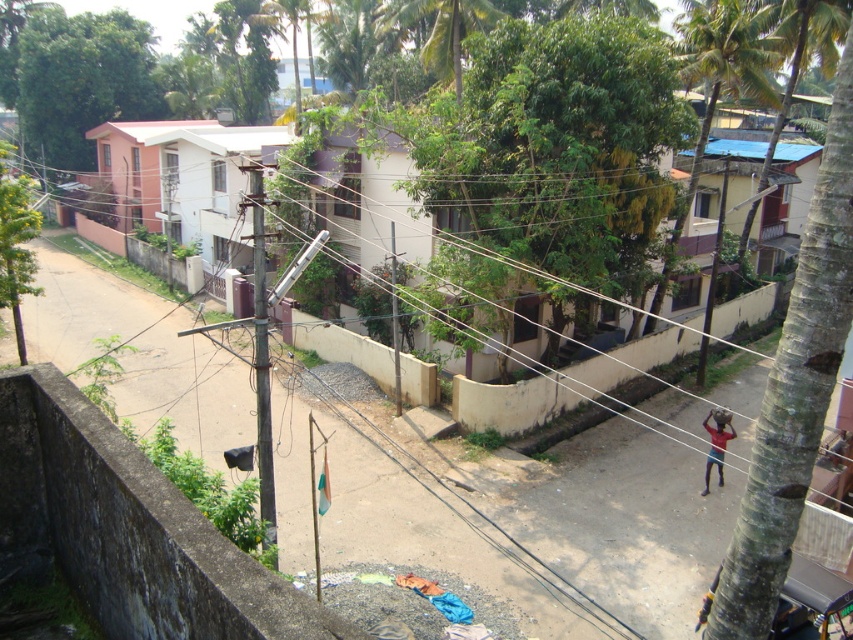
Does green rough bark tree at right appear on the left side of green leafy tree at upper left?

In fact, green rough bark tree at right is to the right of green leafy tree at upper left.

Can you confirm if green rough bark tree at right is bigger than green leafy tree at upper left?

No, green rough bark tree at right is not bigger than green leafy tree at upper left.

Does point (730, 628) come in front of point (22, 131)?

That is True.

Where is `green rough bark tree at right`? The height and width of the screenshot is (640, 853). green rough bark tree at right is located at coordinates (793, 390).

Looking at this image, is green leafy palm tree at upper right bigger than green leafy tree at left?

Indeed, green leafy palm tree at upper right has a larger size compared to green leafy tree at left.

Is the position of green leafy palm tree at upper right less distant than that of green leafy tree at left?

No, it is behind green leafy tree at left.

Does point (747, 52) come behind point (25, 184)?

Yes, point (747, 52) is behind point (25, 184).

This screenshot has width=853, height=640. In order to click on green leafy palm tree at upper right in this screenshot , I will do 718,81.

Can you confirm if green rough bark tree at right is positioned to the right of green leafy palm tree at upper right?

In fact, green rough bark tree at right is to the left of green leafy palm tree at upper right.

Is green rough bark tree at right above green leafy palm tree at upper right?

No, green rough bark tree at right is not above green leafy palm tree at upper right.

Between point (820, 371) and point (747, 3), which one is positioned behind?

The point (747, 3) is behind.

You are a GUI agent. You are given a task and a screenshot of the screen. Output one action in this format:
    pyautogui.click(x=<x>, y=<y>)
    Task: Click on the green rough bark tree at right
    The image size is (853, 640).
    Given the screenshot: What is the action you would take?
    pyautogui.click(x=793, y=390)